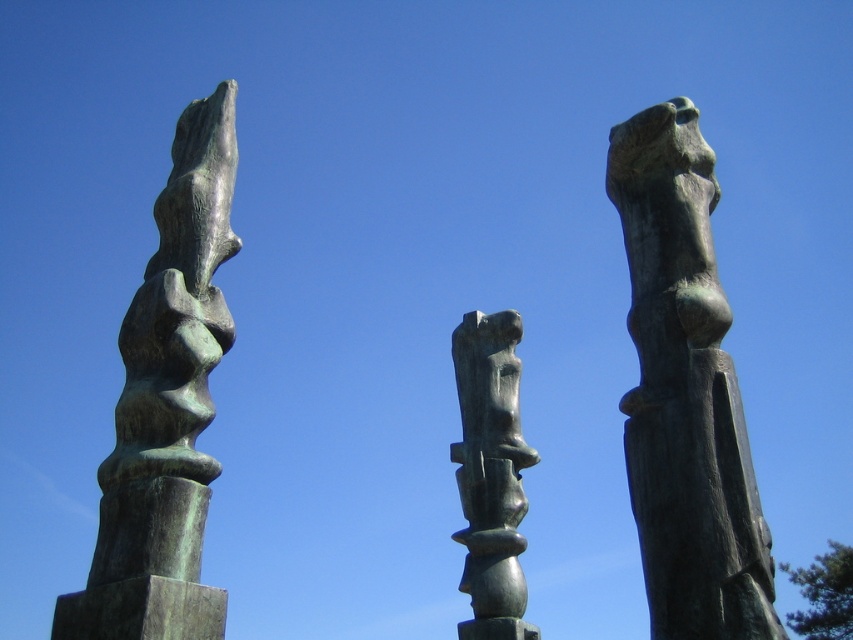
Looking at this image, you are standing in front of the sculptures and want to take a photo of the bronze statue at right and the green patina sculpture at left. Which sculpture will appear larger in the photo?

The bronze statue at right will appear larger in the photo because it is closer to you than the green patina sculpture at left.

You are standing in front of the three sculptures. You notice two points on the middle sculpture. One is at coordinate point [746,566] and the other is at point [496,506]. Which point is closer to your eyes?

Point [746,566] is closer to the camera than point [496,506].

Which sculpture has a point at coordinates [166,406]?

The point at coordinates [166,406] marks the green patina sculpture at left.